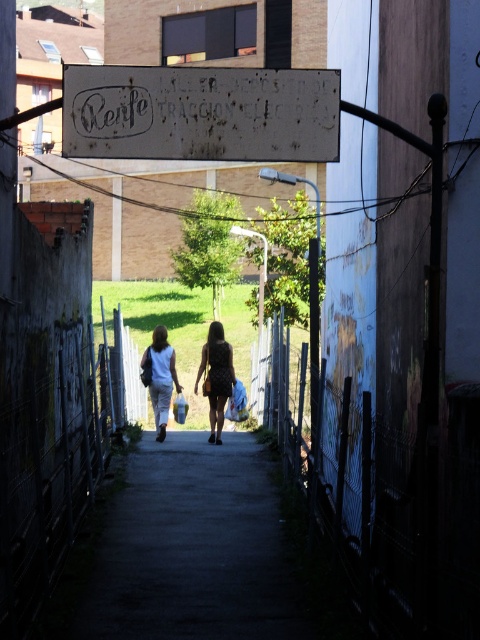
Question: Considering the relative positions of rusty metal sign at upper center and black dotted dress at center in the image provided, where is rusty metal sign at upper center located with respect to black dotted dress at center?

Choices:
 (A) left
 (B) right

Answer: (B)

Question: Among these objects, which one is farthest from the camera?

Choices:
 (A) rusty metal sign at upper center
 (B) black dotted dress at center
 (C) light blue sleeveless top at center

Answer: (B)

Question: Is black dotted dress at center below light blue sleeveless top at center?

Choices:
 (A) no
 (B) yes

Answer: (A)

Question: Can you confirm if rusty metal sign at upper center is positioned to the left of light blue sleeveless top at center?

Choices:
 (A) no
 (B) yes

Answer: (A)

Question: Which of the following is the farthest from the observer?

Choices:
 (A) rusty metal sign at upper center
 (B) light blue sleeveless top at center
 (C) black dotted dress at center

Answer: (C)

Question: Which object is closer to the camera taking this photo?

Choices:
 (A) light blue sleeveless top at center
 (B) black dotted dress at center
 (C) rusty metal sign at upper center

Answer: (C)